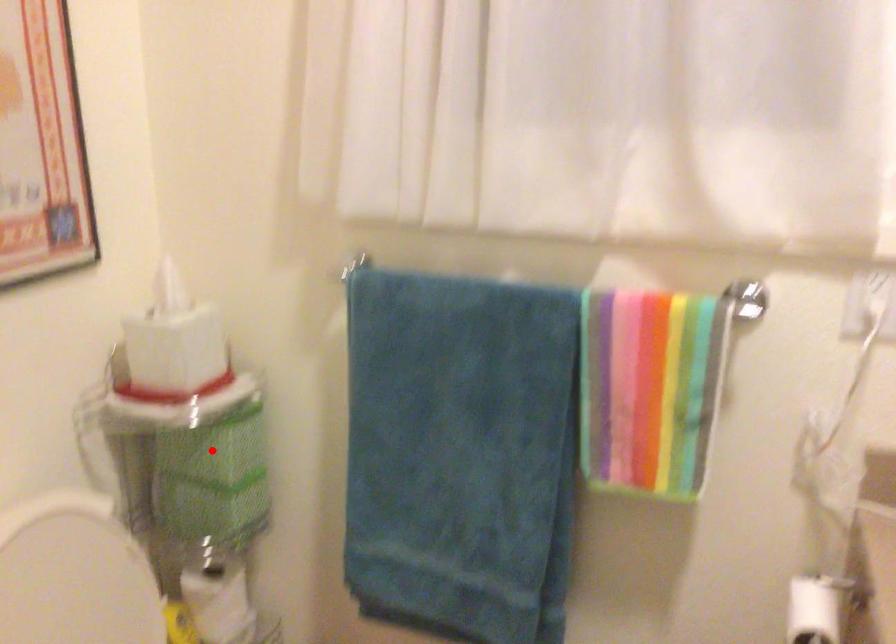
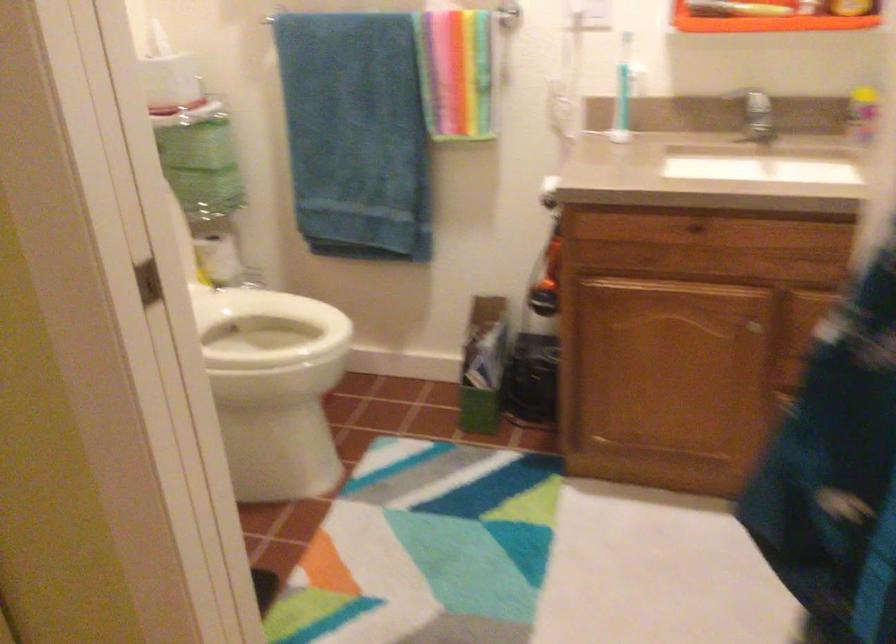
Where in the second image is the point corresponding to the highlighted location from the first image?

(196, 145)